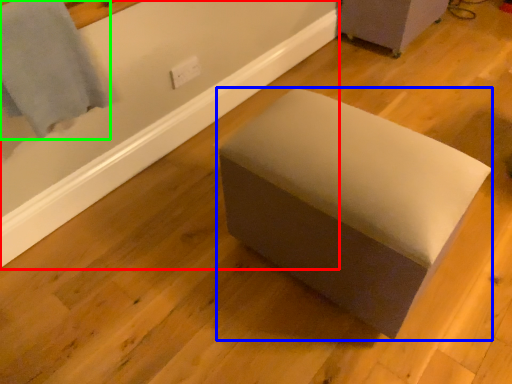
Question: Which is farther away from bath (highlighted by a red box)? furniture (highlighted by a blue box) or bath towel (highlighted by a green box)?

Choices:
 (A) furniture
 (B) bath towel

Answer: (A)